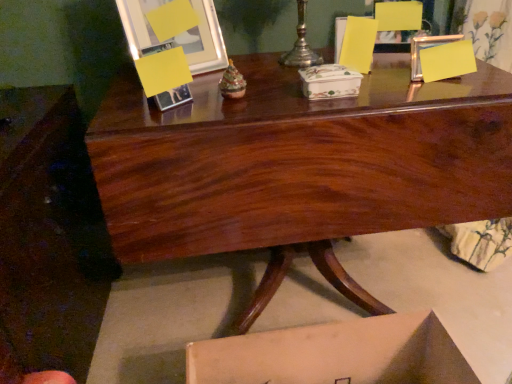
Locate an element on the screen. This screenshot has height=384, width=512. free space to the back side of silver metallic candle holder at upper center is located at coordinates (286, 52).